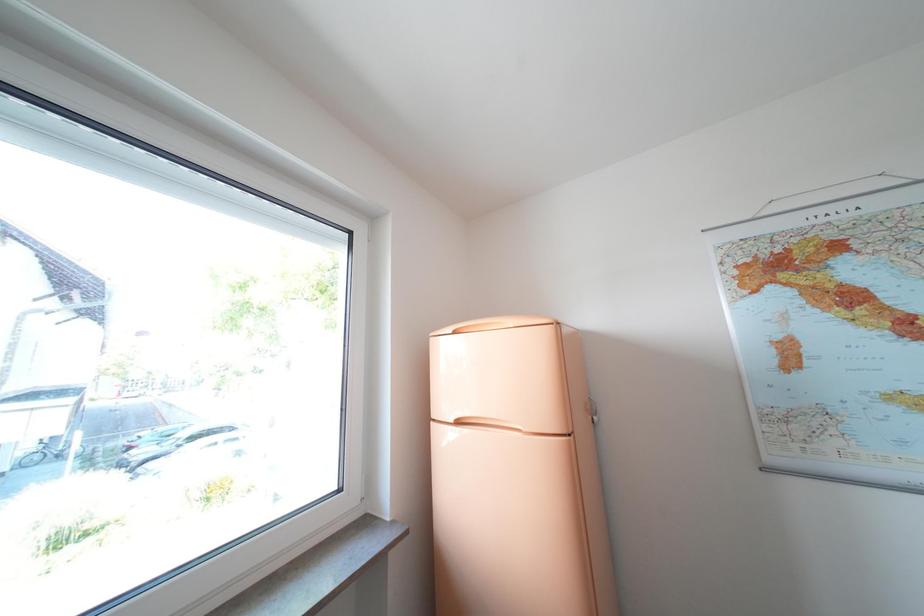
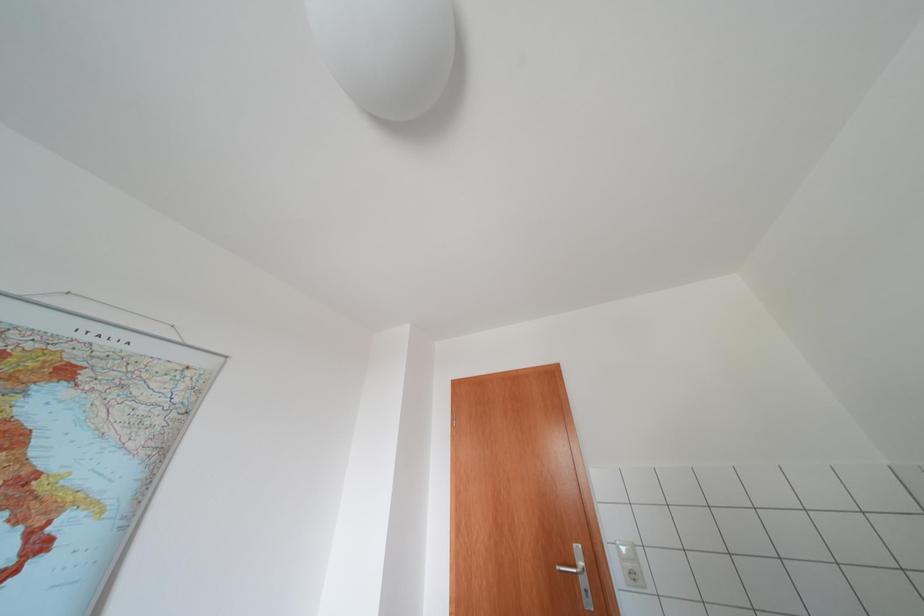
First-person continuous shooting, in which direction is the camera rotating?

The rotation direction of the camera is right-up.